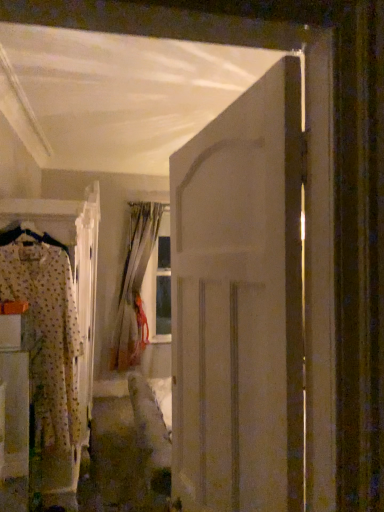
Question: From the image's perspective, relative to patterned fabric pajamas at left, is white matte door at center above or below?

Choices:
 (A) above
 (B) below

Answer: (A)

Question: In terms of size, does white matte door at center appear bigger or smaller than patterned fabric pajamas at left?

Choices:
 (A) small
 (B) big

Answer: (A)

Question: Which is nearer to the silky beige curtain at center?

Choices:
 (A) white matte door at center
 (B) patterned fabric pajamas at left
 (C) fluffy fabric pajama set at left

Answer: (C)

Question: Estimate the real-world distances between objects in this image. Which object is closer to the silky beige curtain at center?

Choices:
 (A) white matte door at center
 (B) patterned fabric pajamas at left
 (C) fluffy fabric pajama set at left

Answer: (C)